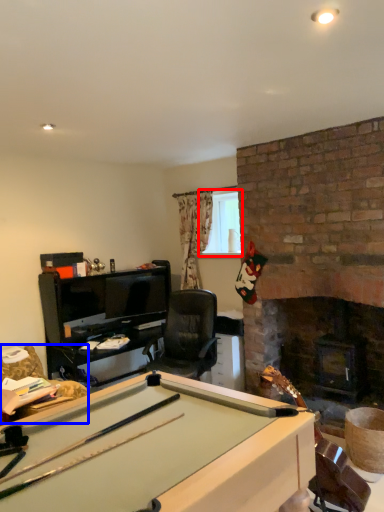
Question: Which object is further to the camera taking this photo, window screen (highlighted by a red box) or swivel chair (highlighted by a blue box)?

Choices:
 (A) window screen
 (B) swivel chair

Answer: (A)